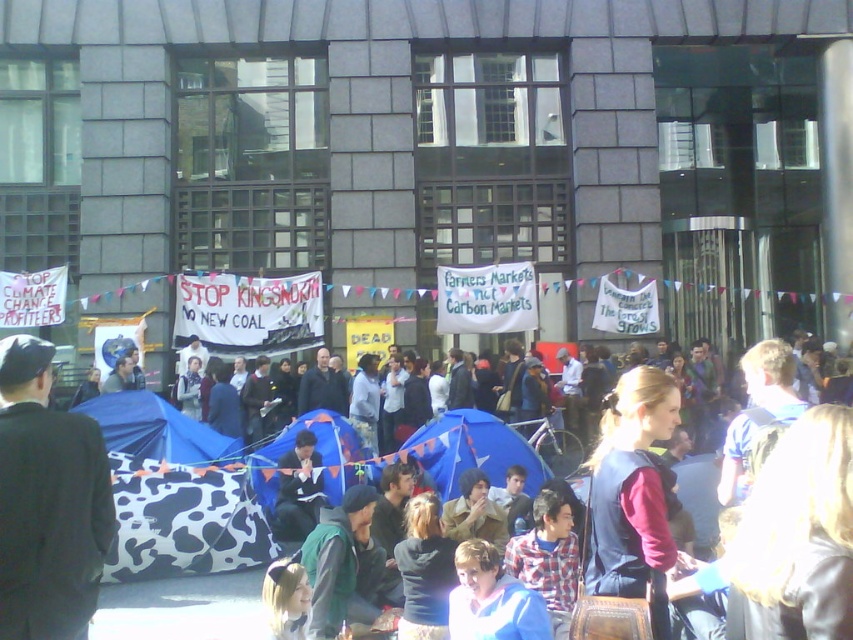
Question: Which point is closer to the camera?

Choices:
 (A) dark suit at center
 (B) cow print fabric tent at lower left

Answer: (A)

Question: Is cow print fabric tent at lower left to the right of cow print fabric tent at center from the viewer's perspective?

Choices:
 (A) yes
 (B) no

Answer: (B)

Question: Considering the relative positions of cow print fabric tent at lower left and dark blue fabric at center in the image provided, where is cow print fabric tent at lower left located with respect to dark blue fabric at center?

Choices:
 (A) below
 (B) above

Answer: (B)

Question: Is the position of cow print fabric tent at lower left less distant than that of cow print fabric tent at center?

Choices:
 (A) yes
 (B) no

Answer: (A)

Question: Which point is farther to the camera?

Choices:
 (A) (248, 472)
 (B) (62, 461)
 (C) (445, 476)
 (D) (155, 435)

Answer: (D)

Question: Which object is positioned farthest from the cow print fabric tent at lower left?

Choices:
 (A) dark suit at center
 (B) blue fabric tent at center

Answer: (A)